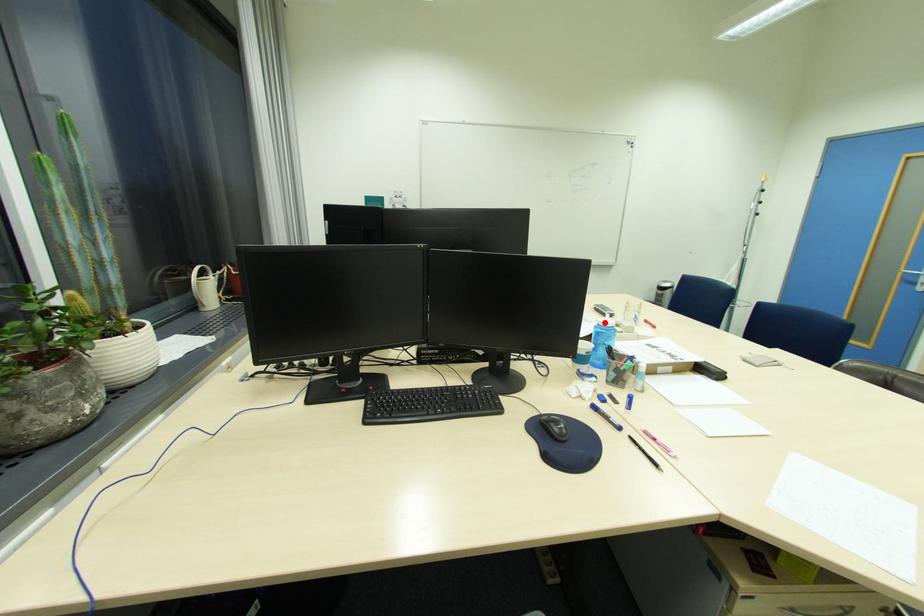
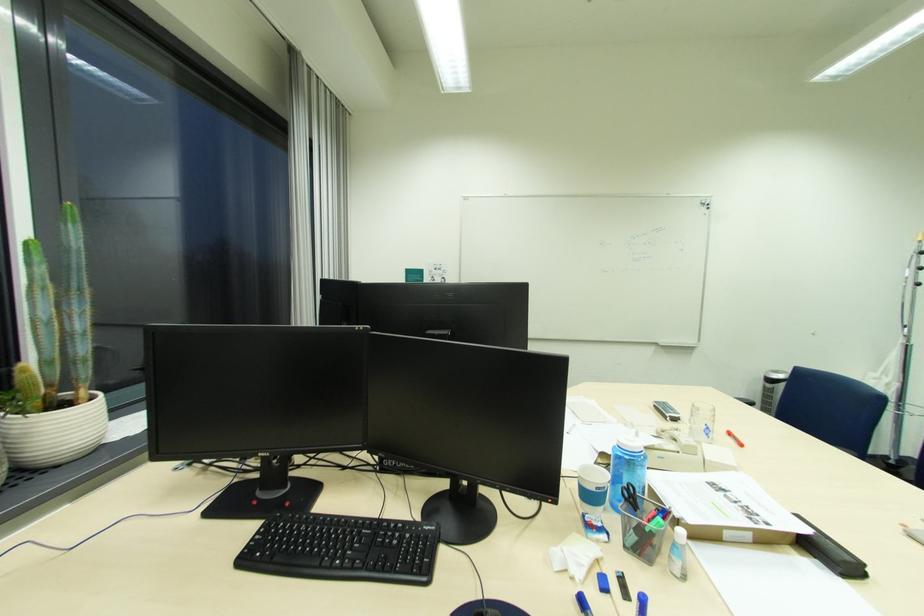
Question: I am providing you with two images of the same scene from different viewpoints. Given a red point in image1, look at the same physical point in image2. Is it:

Choices:
 (A) Closer to the viewpoint
 (B) Farther from the viewpoint

Answer: (A)